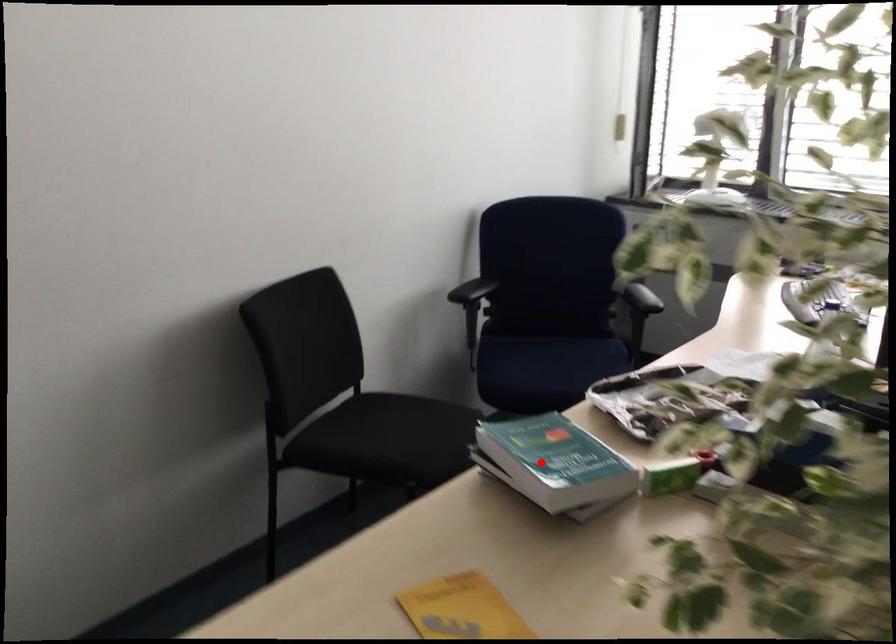
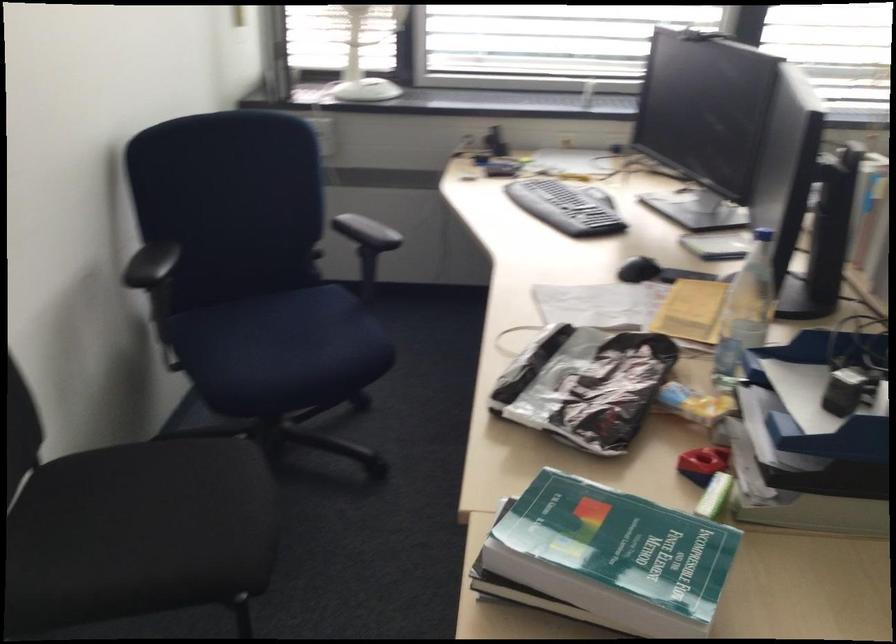
The point at the highlighted location is marked in the first image. Where is the corresponding point in the second image?

(614, 556)